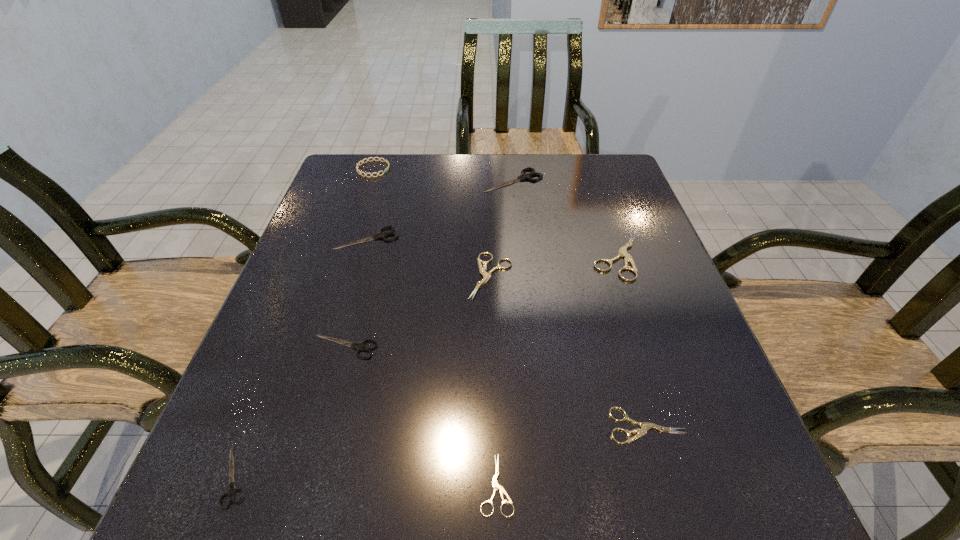
At what (x,y) coordinates should I click in order to perform the action: click on blank space located 0.080m on the left of the third biggest beige shears. Please return your answer as a coordinate pair (x, y). Looking at the image, I should click on (560, 426).

This screenshot has height=540, width=960. In order to click on vacant space located on the right of the smallest black shears in this screenshot , I will do `click(501, 477)`.

This screenshot has height=540, width=960. I want to click on vacant space located 0.110m on the right of the smallest beige shears, so click(x=588, y=484).

Locate an element on the screen. This screenshot has width=960, height=540. bracelet that is at the far edge is located at coordinates [x=379, y=159].

Find the location of `shears situated at the far edge`. shears situated at the far edge is located at coordinates (523, 176).

The width and height of the screenshot is (960, 540). I want to click on bracelet that is at the left edge, so click(x=379, y=159).

Where is `object present at the far left corner`? object present at the far left corner is located at coordinates (379, 159).

You are a GUI agent. You are given a task and a screenshot of the screen. Output one action in this format:
    pyautogui.click(x=<x>, y=<y>)
    Task: Click on the object that is at the near left corner
    
    Given the screenshot: What is the action you would take?
    pyautogui.click(x=232, y=490)

Find the location of a particular element. vacant area at the far edge of the desktop is located at coordinates (484, 195).

In the image, there is a desktop. At what (x,y) coordinates should I click in order to perform the action: click on vacant region at the near edge. Please return your answer as a coordinate pair (x, y). The height and width of the screenshot is (540, 960). Looking at the image, I should click on (618, 480).